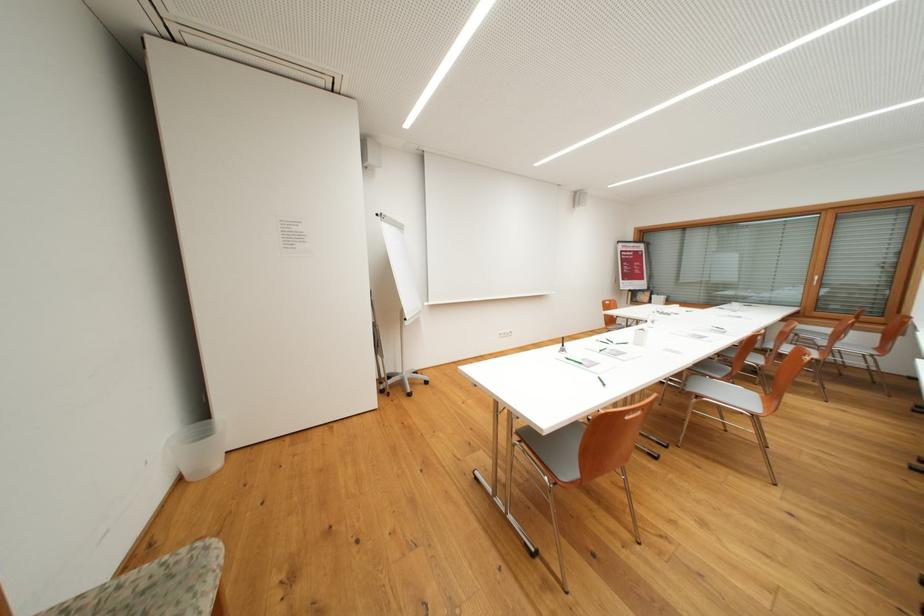
Locate an element on the screen. Image resolution: width=924 pixels, height=616 pixels. whiteboard on wheels is located at coordinates (399, 267).